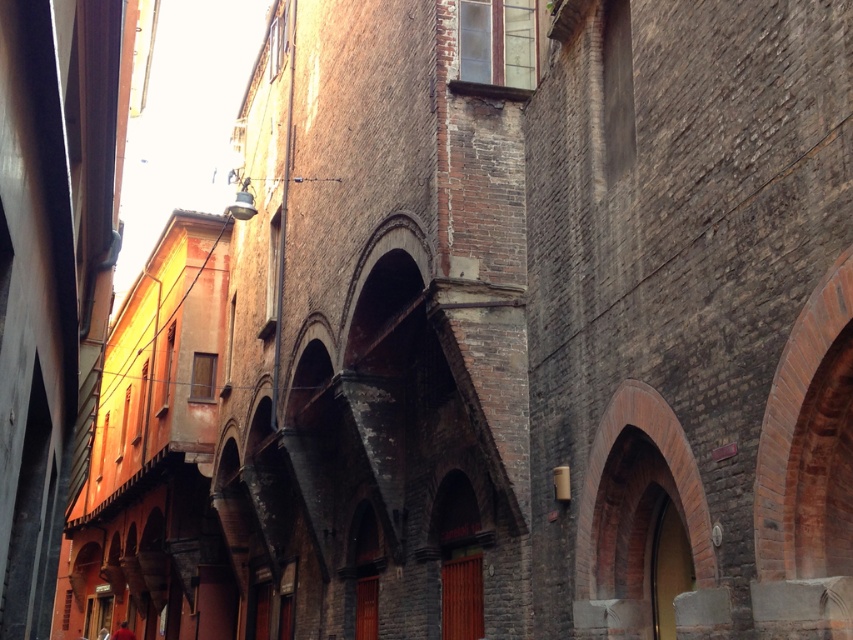
Question: Which object appears closest to the camera in this image?

Choices:
 (A) brick textured archway at center
 (B) red cloth at lower left

Answer: (A)

Question: Is brick textured archway at center below red cloth at lower left?

Choices:
 (A) no
 (B) yes

Answer: (A)

Question: Which of the following is the farthest from the observer?

Choices:
 (A) brick textured archway at center
 (B) red cloth at lower left

Answer: (B)

Question: Can you confirm if brick textured archway at center is positioned below red cloth at lower left?

Choices:
 (A) yes
 (B) no

Answer: (B)

Question: Can you confirm if brick textured archway at center is bigger than red cloth at lower left?

Choices:
 (A) yes
 (B) no

Answer: (B)

Question: Which point is closer to the camera taking this photo?

Choices:
 (A) (125, 636)
 (B) (648, 422)

Answer: (B)